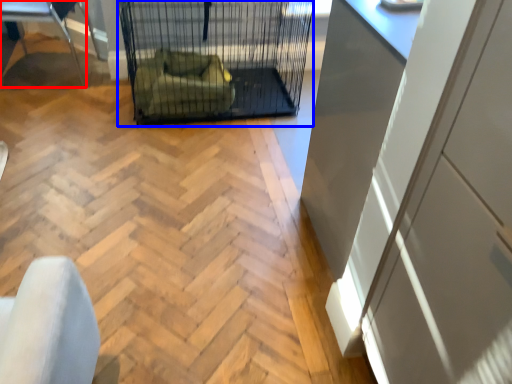
Question: Among these objects, which one is nearest to the camera, furniture (highlighted by a red box) or bird cage (highlighted by a blue box)?

Choices:
 (A) furniture
 (B) bird cage

Answer: (B)